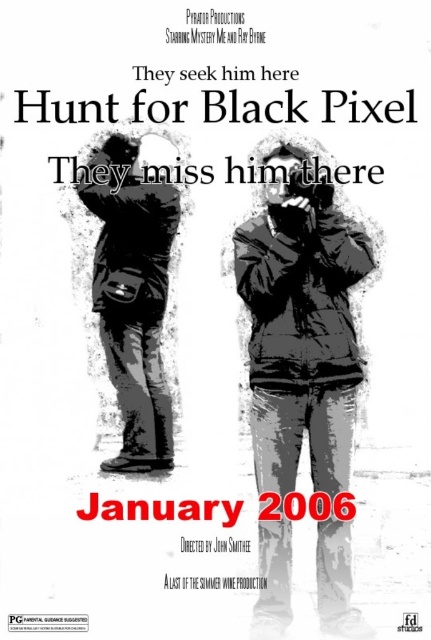
What are the coordinates of the denim jacket at center in the movie poster?

The denim jacket at center is located at point (300, 337).

You are standing in front of the movie poster for Hunt for Black Pixel. The poster has a central point marked at coordinates (300, 337). Where would you find the denim jacket at center on the poster?

The denim jacket at center is located at point (300, 337).